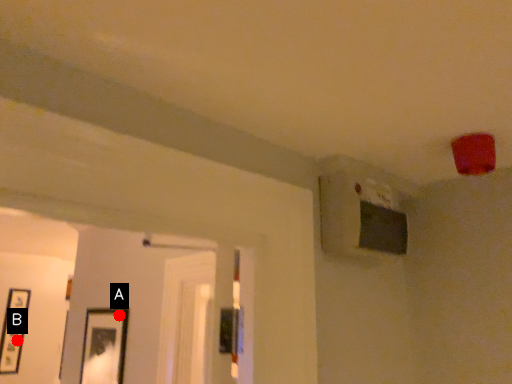
Question: Two points are circled on the image, labeled by A and B beside each circle. Among these points, which one is farthest from the camera?

Choices:
 (A) A is further
 (B) B is further

Answer: (B)